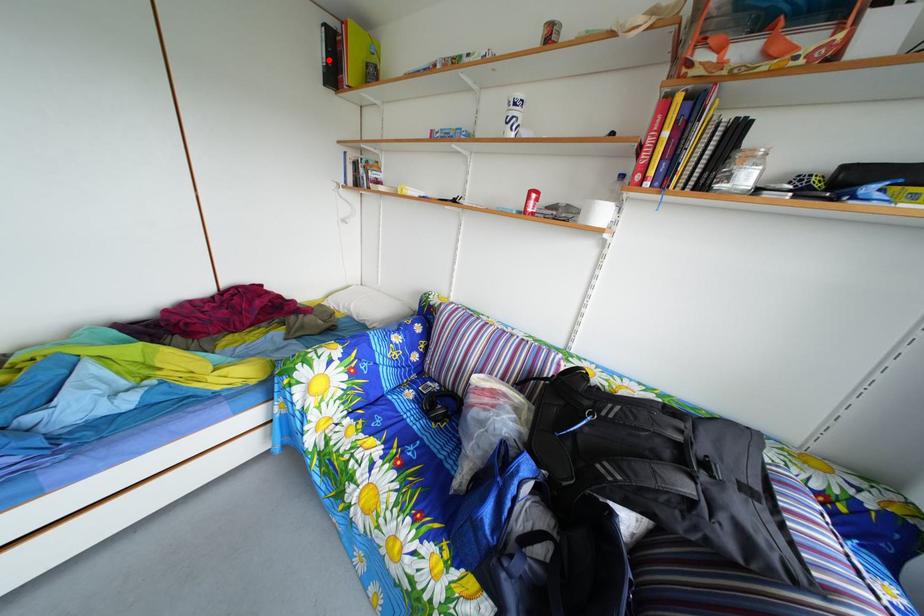
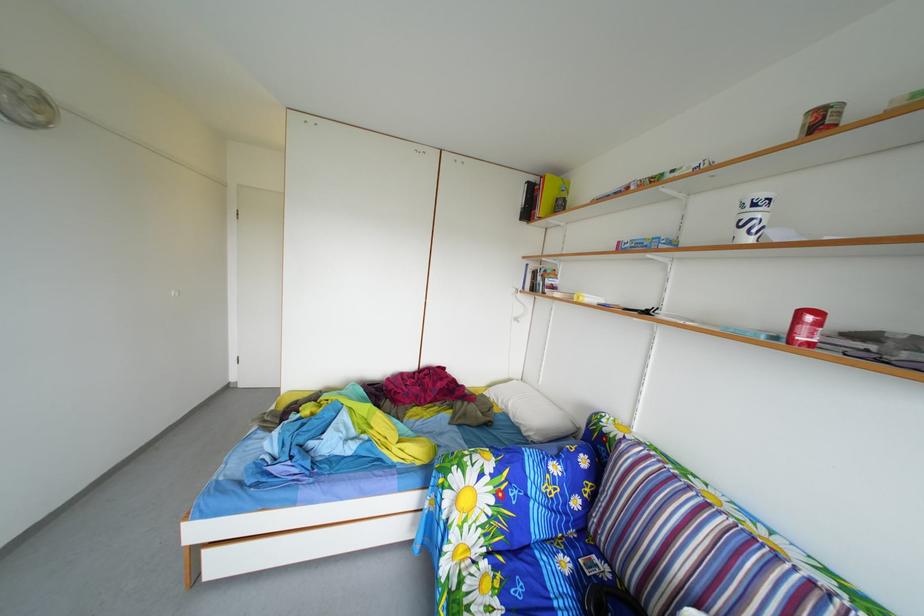
In the second image, find the point that corresponds to the highlighted location in the first image.

(530, 208)